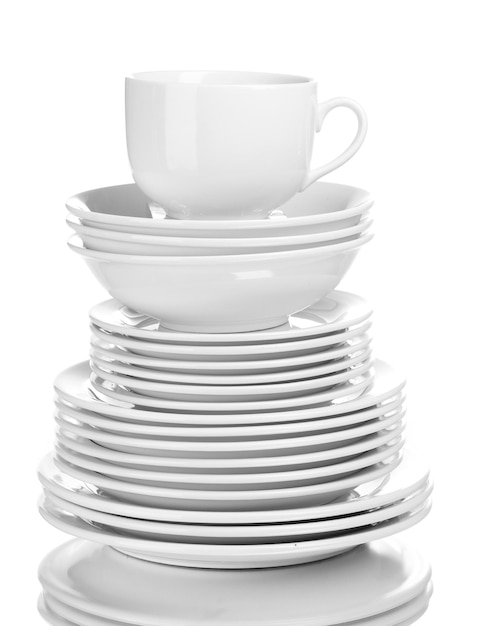
Where is `plates`? plates is located at coordinates 417,617, 417,603, 417,590, 115,394, 120,382, 125,370, 130,359, 137,346, 138,337.